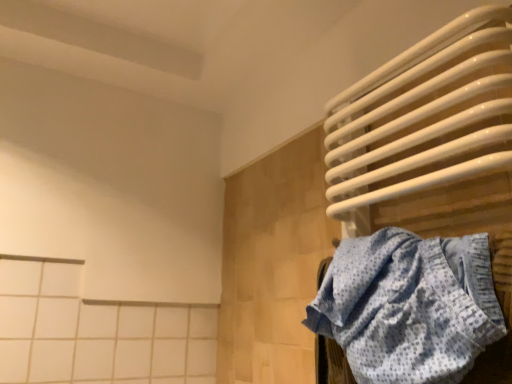
Looking at this image, in order to face white glossy towel rack at upper right, should I rotate leftwards or rightwards?

You should look right and rotate roughly 20.178 degrees.

Image resolution: width=512 pixels, height=384 pixels. Describe the element at coordinates (431, 140) in the screenshot. I see `white glossy towel rack at upper right` at that location.

At what (x,y) coordinates should I click in order to perform the action: click on white glossy towel rack at upper right. Please return your answer as a coordinate pair (x, y). Looking at the image, I should click on (431, 140).

What do you see at coordinates (409, 306) in the screenshot?
I see `blue dotted fabric at right` at bounding box center [409, 306].

Where is `blue dotted fabric at right`? This screenshot has width=512, height=384. blue dotted fabric at right is located at coordinates (409, 306).

Locate an element on the screen. The height and width of the screenshot is (384, 512). white glossy towel rack at upper right is located at coordinates (431, 140).

Is white glossy towel rack at upper right at the right side of blue dotted fabric at right?

Indeed, white glossy towel rack at upper right is positioned on the right side of blue dotted fabric at right.

Is white glossy towel rack at upper right positioned before blue dotted fabric at right?

No, it is not.

Is point (477, 373) closer to camera compared to point (378, 366)?

Yes, point (477, 373) is in front of point (378, 366).

From the image's perspective, which one is positioned higher, white glossy towel rack at upper right or blue dotted fabric at right?

white glossy towel rack at upper right.

From a real-world perspective, is white glossy towel rack at upper right located beneath blue dotted fabric at right?

Incorrect, from a real-world perspective, white glossy towel rack at upper right is higher than blue dotted fabric at right.

Which of these two, white glossy towel rack at upper right or blue dotted fabric at right, is thinner?

white glossy towel rack at upper right.

Is white glossy towel rack at upper right taller than blue dotted fabric at right?

Yes, white glossy towel rack at upper right is taller than blue dotted fabric at right.

Does white glossy towel rack at upper right have a larger size compared to blue dotted fabric at right?

Yes, white glossy towel rack at upper right is bigger than blue dotted fabric at right.

Choose the correct answer: Is white glossy towel rack at upper right inside blue dotted fabric at right or outside it?

white glossy towel rack at upper right is located beyond the bounds of blue dotted fabric at right.

Is there a large distance between white glossy towel rack at upper right and blue dotted fabric at right?

That's not correct — white glossy towel rack at upper right is a little close to blue dotted fabric at right.

Is blue dotted fabric at right at the back of white glossy towel rack at upper right?

Yes, white glossy towel rack at upper right is positioned with its back facing blue dotted fabric at right.

At what (x,y) coordinates should I click in order to perform the action: click on water heater behind the blue dotted fabric at right. Please return your answer as a coordinate pair (x, y). Looking at the image, I should click on 431,140.

Which is more to the left, blue dotted fabric at right or white glossy towel rack at upper right?

From the viewer's perspective, blue dotted fabric at right appears more on the left side.

Which object is further away from the camera, blue dotted fabric at right or white glossy towel rack at upper right?

white glossy towel rack at upper right is further away from the camera.

Which is closer to the camera, (448,309) or (430,76)?

Point (448,309) appears to be closer to the viewer than point (430,76).

From the image's perspective, which is below, blue dotted fabric at right or white glossy towel rack at upper right?

blue dotted fabric at right appears lower in the image.

From a real-world perspective, which object rests below the other?

blue dotted fabric at right is physically lower.

Does blue dotted fabric at right have a lesser width compared to white glossy towel rack at upper right?

Result: Incorrect, the width of blue dotted fabric at right is not less than that of white glossy towel rack at upper right.

Considering the sizes of blue dotted fabric at right and white glossy towel rack at upper right in the image, is blue dotted fabric at right taller or shorter than white glossy towel rack at upper right?

In the image, blue dotted fabric at right appears to be shorter than white glossy towel rack at upper right.

Which of these two, blue dotted fabric at right or white glossy towel rack at upper right, is smaller?

blue dotted fabric at right.

Is white glossy towel rack at upper right surrounded by blue dotted fabric at right?

No, white glossy towel rack at upper right is not a part of blue dotted fabric at right.

Are blue dotted fabric at right and white glossy towel rack at upper right beside each other?

They are not placed beside each other.

Is white glossy towel rack at upper right at the back of blue dotted fabric at right?

Absolutely, blue dotted fabric at right is directed away from white glossy towel rack at upper right.

Where is `water heater located above the blue dotted fabric at right (from the image's perspective)`? Image resolution: width=512 pixels, height=384 pixels. water heater located above the blue dotted fabric at right (from the image's perspective) is located at coordinates (431, 140).

The image size is (512, 384). I want to click on towel below the white glossy towel rack at upper right (from a real-world perspective), so click(409, 306).

Where is `water heater above the blue dotted fabric at right (from a real-world perspective)`? water heater above the blue dotted fabric at right (from a real-world perspective) is located at coordinates (x=431, y=140).